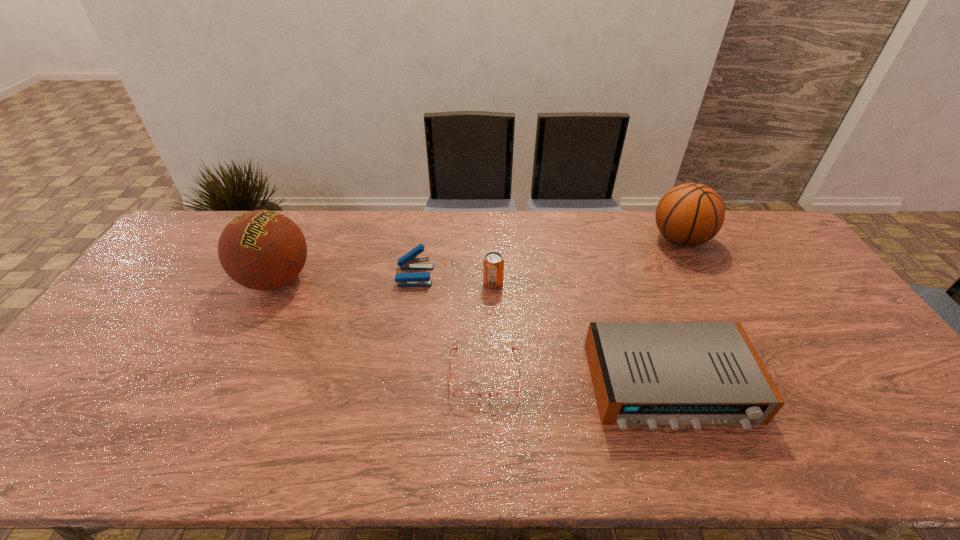
Identify which object is located as the second nearest to the soda can. Please provide its 2D coordinates. Your answer should be formatted as a tuple, i.e. [(x, y)], where the tuple contains the x and y coordinates of a point satisfying the conditions above.

[(467, 396)]

Identify which object is the second nearest to the right basketball. Please provide its 2D coordinates. Your answer should be formatted as a tuple, i.e. [(x, y)], where the tuple contains the x and y coordinates of a point satisfying the conditions above.

[(493, 264)]

The width and height of the screenshot is (960, 540). I want to click on free space that satisfies the following two spatial constraints: 1. on the back side of the second object from left to right; 2. on the right side of the left basketball, so click(x=278, y=275).